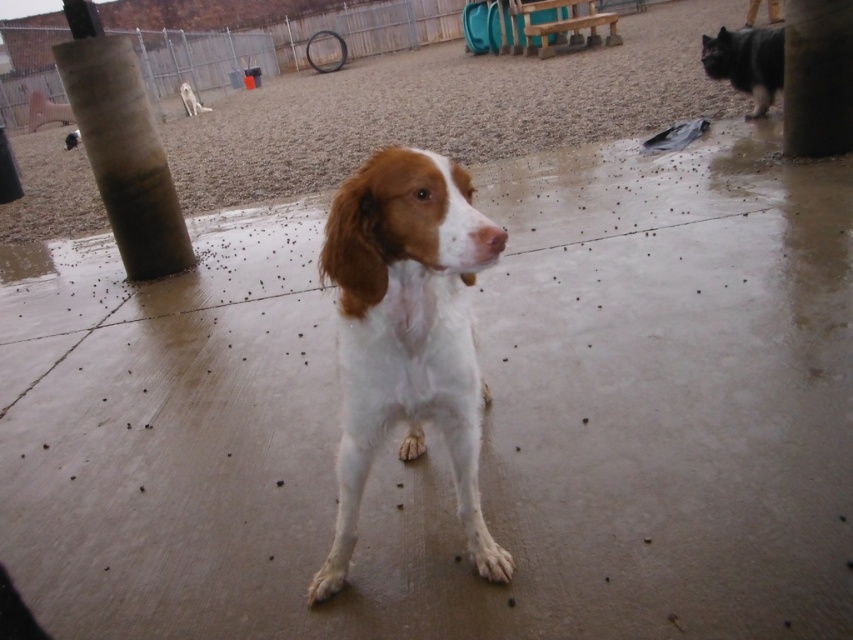
You are standing in the fenced area and want to walk from point (843, 19) to point (140, 273). Which direction should you face to move towards the closer point?

Point (140, 273) is closer to you than point (843, 19), so you should face towards point (140, 273) to move towards the closer point.

You are a dog owner who wants to ensure your dog stays dry. You see the white matte dog at center and the dark brown fur dog at upper right. Which dog is closer to the wet concrete area?

The white matte dog at center is positioned under the dark brown fur dog at upper right, meaning it is closer to the wet concrete area. Therefore, the white matte dog at center is the one closer to the wet concrete.